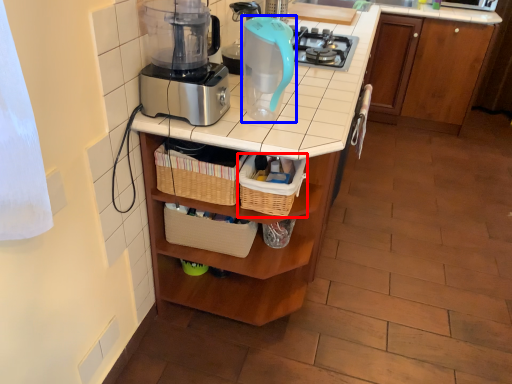
Question: Which of the following is the farthest to the observer, basket (highlighted by a red box) or kitchen appliance (highlighted by a blue box)?

Choices:
 (A) basket
 (B) kitchen appliance

Answer: (A)